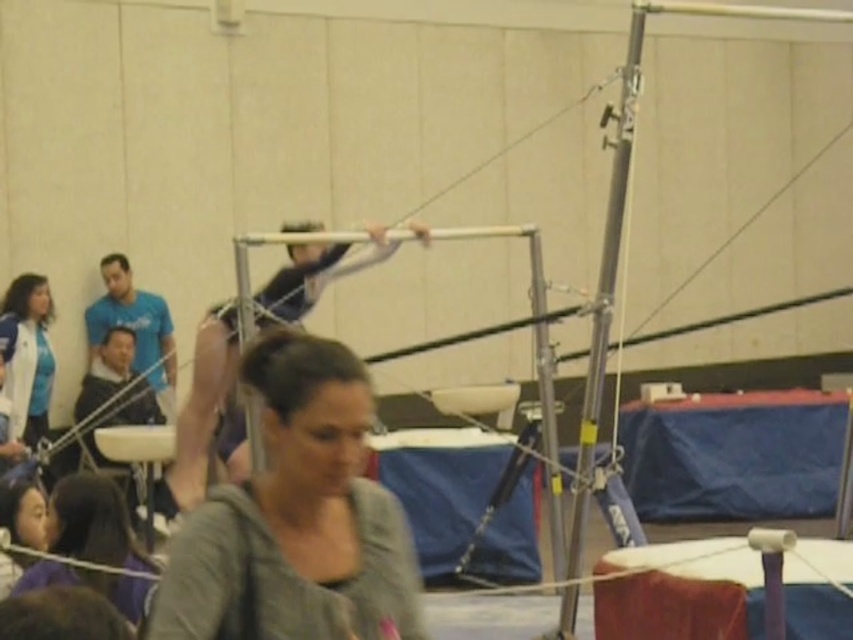
You are a gymnast preparing for a dismount. You need to land on the smooth purple mat at center. The coach says you must avoid the area near the point at coordinates point (682, 593). Where should you aim to land on the smooth purple mat at center?

The point (682, 593) indicates the smooth purple mat at center, so you should aim to land on the smooth purple mat at center but avoid the area near the coordinates point (682, 593).

You are a gymnast preparing to perform on the uneven bars. You want to land safely on the safety mats after your routine. The safety mats are located at point (724, 564). If you release the bars and fall straight down, will you land on the safety mats?

The safety mats are located at point (724, 564). Since you will fall straight down from the bars, your landing point will be directly below the bars. The distance between the bars and the mats is 5.95 meters, which means you will not land on the safety mats.

You are a gymnast preparing to perform on the uneven bars. You need to place your personal item on the safety mats so that it won not interfere with your routine. Where should you place it relative to the gray matte jacket at center?

You should place your personal item on the safety mats away from the gray matte jacket at center to avoid interference with the routine.